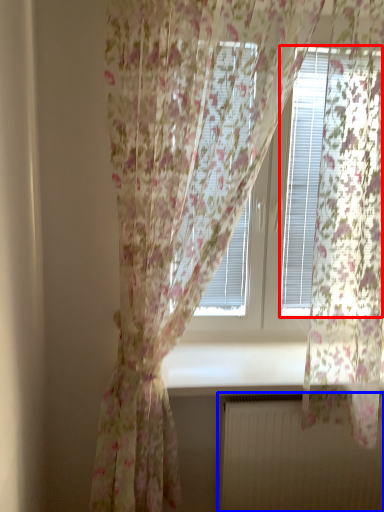
Question: Among these objects, which one is nearest to the camera, blind (highlighted by a red box) or radiator (highlighted by a blue box)?

Choices:
 (A) blind
 (B) radiator

Answer: (A)